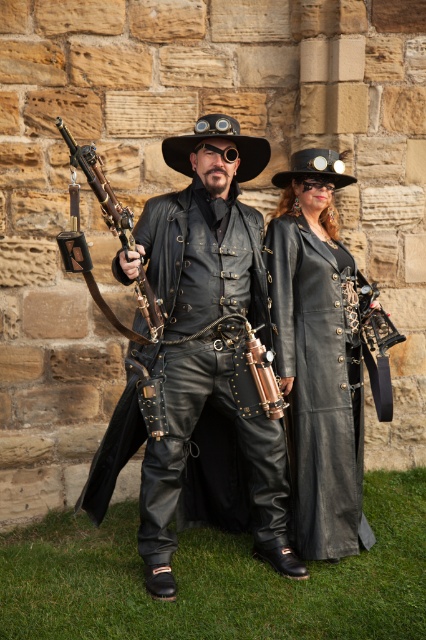
Question: Is leather jacket at center bigger than polished brass rifle at center?

Choices:
 (A) no
 (B) yes

Answer: (B)

Question: Which of the following is the closest to the observer?

Choices:
 (A) (330, 536)
 (B) (189, 320)
 (C) (132, 228)

Answer: (C)

Question: Which object appears closest to the camera in this image?

Choices:
 (A) polished brass rifle at center
 (B) leather jacket at center

Answer: (A)

Question: Does matte black coat at center appear on the right side of polished brass rifle at center?

Choices:
 (A) no
 (B) yes

Answer: (B)

Question: Among these objects, which one is farthest from the camera?

Choices:
 (A) matte black coat at center
 (B) polished brass rifle at center
 (C) leather jacket at center

Answer: (A)

Question: In this image, where is leather jacket at center located relative to polished brass rifle at center?

Choices:
 (A) right
 (B) left

Answer: (A)